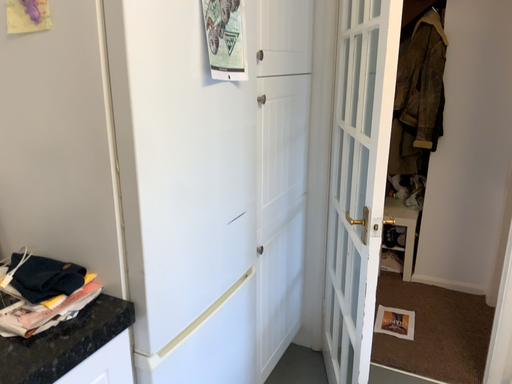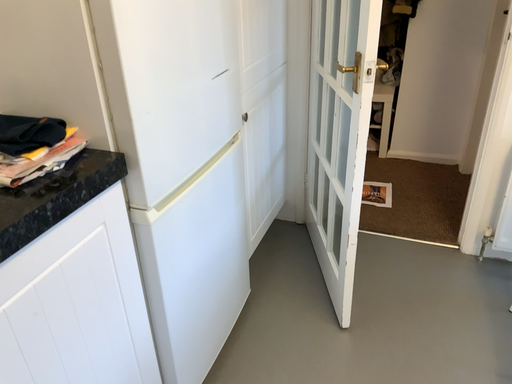
Question: How did the camera likely rotate when shooting the video?

Choices:
 (A) rotated upward
 (B) rotated downward

Answer: (B)